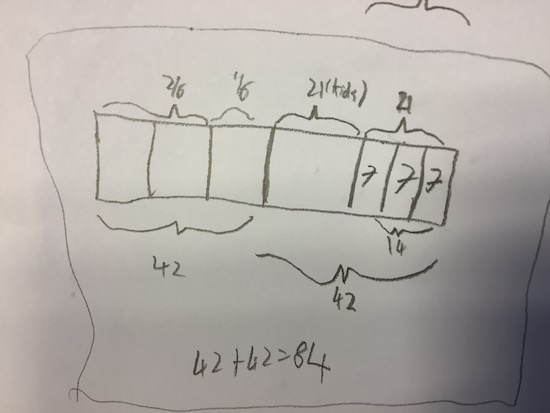
In order to click on bracket in this screenshot , I will do `click(403, 130)`, `click(415, 6)`, `click(318, 115)`, `click(240, 111)`, `click(180, 115)`, `click(181, 230)`, `click(342, 275)`, `click(395, 229)`.